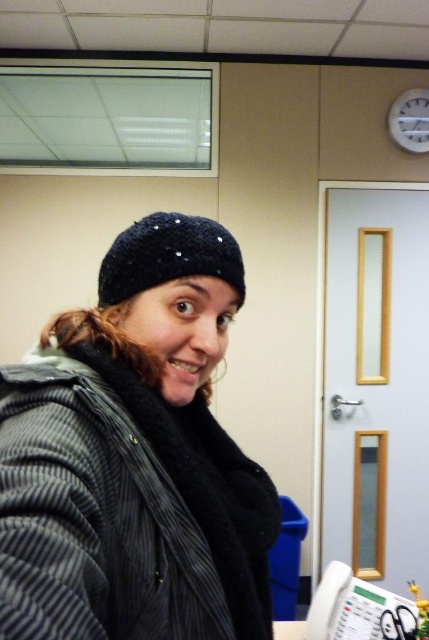
You are standing in an office and see the striped woolen jacket at center. Can you estimate its position using a coordinate system where the bottom left corner is the origin?

The striped woolen jacket at center is located at coordinates approximately 0.797 on the x axis and 0.291 on the y axis.

From the picture: You are taking a photo of two points in the office scene described. The first point is at coordinate point(215, 253) and the second is at point(408, 96). Which point will appear larger in your photo?

Point(215, 253) is closer to the camera than point(408, 96), so it will appear larger in the photo.

You are an interior designer assessing the placement of items in an office. You notice the striped woolen jacket at center and the white plastic clock at upper right. Which object occupies a greater vertical space in the scene?

The striped woolen jacket at center occupies a greater vertical space in the scene as it is much taller than the white plastic clock at upper right.